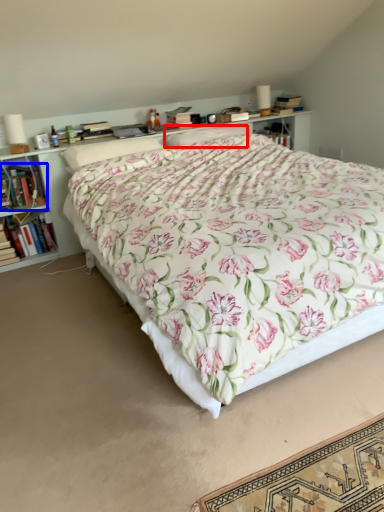
Question: Which object is closer to the camera taking this photo, pillow (highlighted by a red box) or book (highlighted by a blue box)?

Choices:
 (A) pillow
 (B) book

Answer: (B)